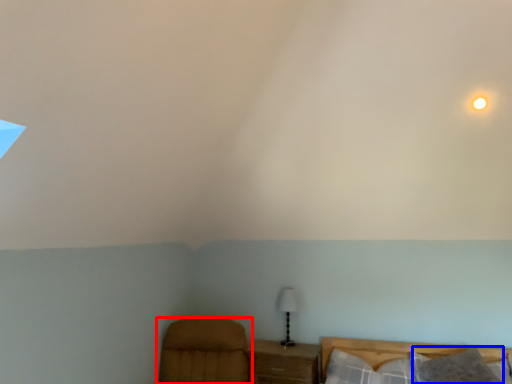
Question: Which object is closer to the camera taking this photo, furniture (highlighted by a red box) or pillow (highlighted by a blue box)?

Choices:
 (A) furniture
 (B) pillow

Answer: (A)